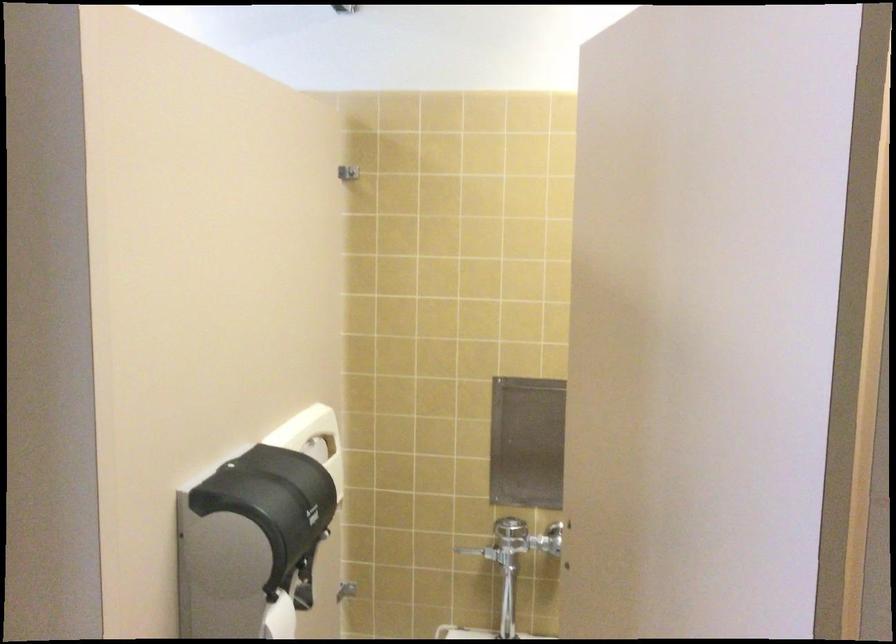
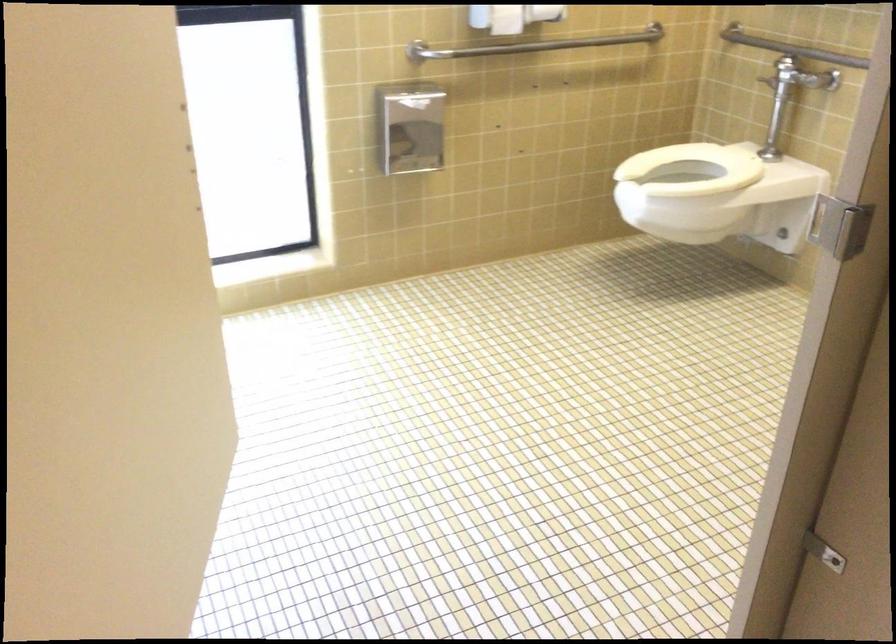
First-person continuous shooting, in which direction is the camera rotating?

The camera rotated toward left-down.